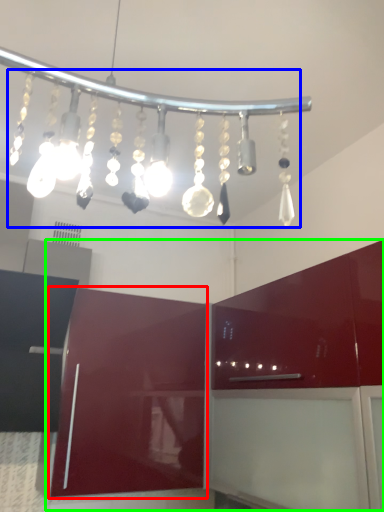
Question: Estimate the real-world distances between objects in this image. Which object is closer to cabinetry (highlighted by a red box), chandelier (highlighted by a blue box) or cabinetry (highlighted by a green box)?

Choices:
 (A) chandelier
 (B) cabinetry

Answer: (B)